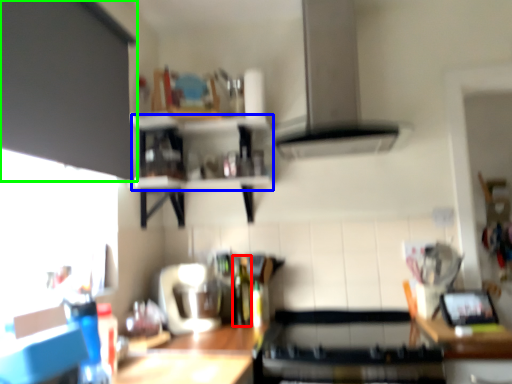
Question: Which object is the closest to the bottle (highlighted by a red box)? Choose among these: shelf (highlighted by a blue box) or cabinetry (highlighted by a green box).

Choices:
 (A) shelf
 (B) cabinetry

Answer: (A)